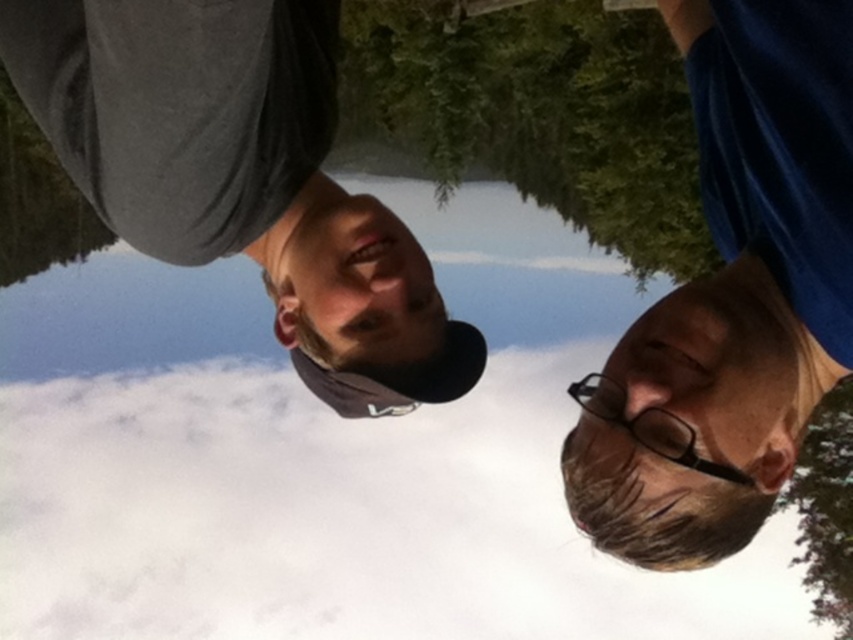
Can you confirm if blue fabric at right is shorter than blue sky at upper center?

Yes.

Is point (793, 280) closer to viewer compared to point (57, 294)?

Yes, it is.

What do you see at coordinates (732, 296) in the screenshot? Image resolution: width=853 pixels, height=640 pixels. I see `blue fabric at right` at bounding box center [732, 296].

Identify the location of blue fabric at right. The width and height of the screenshot is (853, 640). (732, 296).

Identify the location of blue sky at upper center. pos(131,316).

Can you confirm if blue sky at upper center is taller than black plastic glasses at lower right?

Yes.

The image size is (853, 640). I want to click on blue sky at upper center, so click(x=131, y=316).

At what (x,y) coordinates should I click in order to perform the action: click on blue sky at upper center. Please return your answer as a coordinate pair (x, y). Looking at the image, I should click on (131, 316).

Who is more distant from viewer, (840, 77) or (674, 429)?

Positioned behind is point (674, 429).

Consider the image. Which of these two, blue fabric at right or black plastic glasses at lower right, stands shorter?

black plastic glasses at lower right is shorter.

Which is behind, point (746, 112) or point (663, 410)?

Positioned behind is point (746, 112).

What are the coordinates of `blue fabric at right` in the screenshot? It's located at (732, 296).